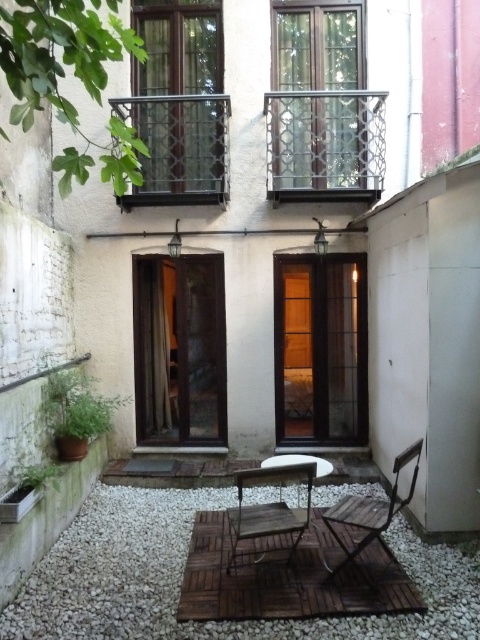
Question: Which of the following is the closest to the observer?

Choices:
 (A) (298, 524)
 (B) (83, 625)

Answer: (B)

Question: Is wooden chair at center to the left of wooden chair at lower right from the viewer's perspective?

Choices:
 (A) yes
 (B) no

Answer: (A)

Question: Can you confirm if white gravel at center is positioned below wooden chair at lower right?

Choices:
 (A) no
 (B) yes

Answer: (B)

Question: Which point is closer to the camera?

Choices:
 (A) wooden table at center
 (B) wooden chair at center
 (C) wooden chair at lower right
 (D) white gravel at center

Answer: (D)

Question: Can you confirm if wooden chair at center is positioned to the left of wooden table at center?

Choices:
 (A) no
 (B) yes

Answer: (B)

Question: Which object appears closest to the camera in this image?

Choices:
 (A) white gravel at center
 (B) wooden table at center

Answer: (A)